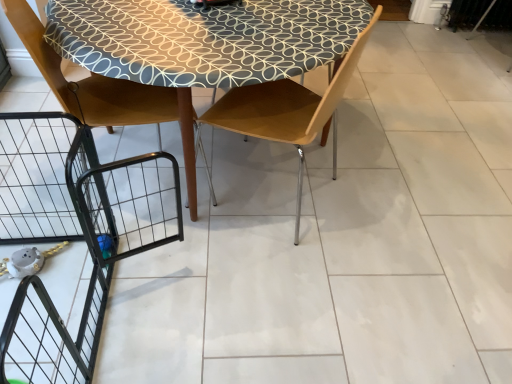
The image size is (512, 384). In order to click on vacant area that is in front of matte brown chair at left, which ranks as the first chair in left-to-right order in this screenshot , I will do `click(127, 272)`.